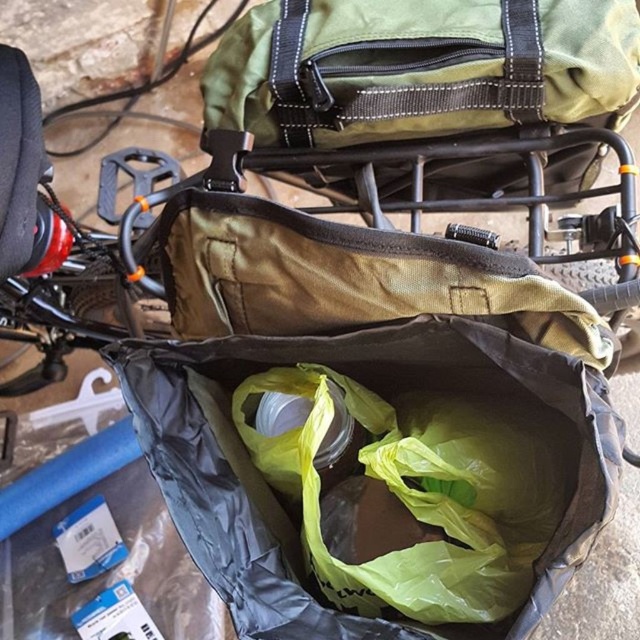
Question: Observing the image, what is the correct spatial positioning of matte brown fabric bag at center in reference to matte green fabric baby carriage at upper center?

Choices:
 (A) below
 (B) above

Answer: (A)

Question: Is matte brown fabric bag at center positioned before matte green fabric baby carriage at upper center?

Choices:
 (A) yes
 (B) no

Answer: (A)

Question: Which point is closer to the camera?

Choices:
 (A) matte green fabric baby carriage at upper center
 (B) matte brown fabric bag at center

Answer: (B)

Question: Does matte brown fabric bag at center appear over matte green fabric baby carriage at upper center?

Choices:
 (A) no
 (B) yes

Answer: (A)

Question: Among these points, which one is farthest from the camera?

Choices:
 (A) (522, 339)
 (B) (541, 96)

Answer: (B)